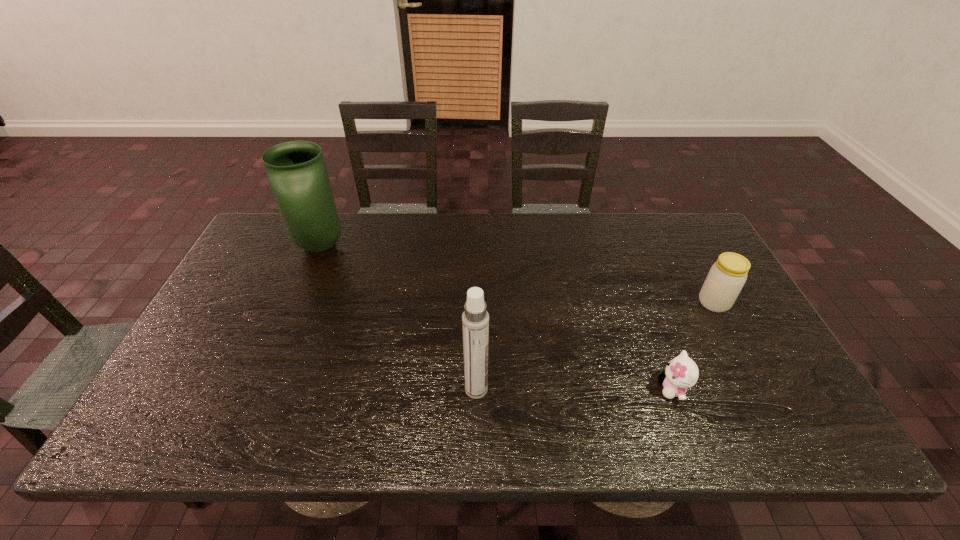
Where is `the leftmost object`? This screenshot has height=540, width=960. the leftmost object is located at coordinates (297, 174).

At what (x,y) coordinates should I click in order to perform the action: click on the farthest object. Please return your answer as a coordinate pair (x, y). Looking at the image, I should click on (297, 174).

Where is `aerosol can`? aerosol can is located at coordinates (475, 319).

Locate an element on the screen. The image size is (960, 540). the rightmost object is located at coordinates (727, 276).

Image resolution: width=960 pixels, height=540 pixels. Identify the location of jar. (727, 276).

The width and height of the screenshot is (960, 540). I want to click on the second object from right to left, so click(681, 373).

What are the coordinates of `kitten` in the screenshot? It's located at (681, 373).

This screenshot has width=960, height=540. Find the location of `free point located 0.260m on the right of the leftmost object`. free point located 0.260m on the right of the leftmost object is located at coordinates (426, 246).

This screenshot has width=960, height=540. In order to click on blank area located on the left of the aerosol can in this screenshot , I will do `click(336, 389)`.

Where is `free space located on the front of the third tallest object`? This screenshot has height=540, width=960. free space located on the front of the third tallest object is located at coordinates (748, 366).